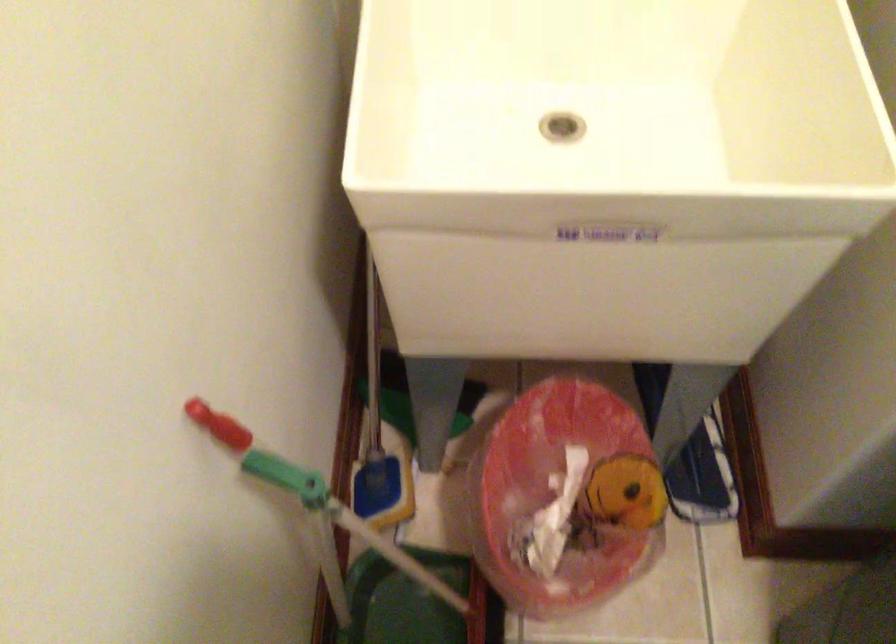
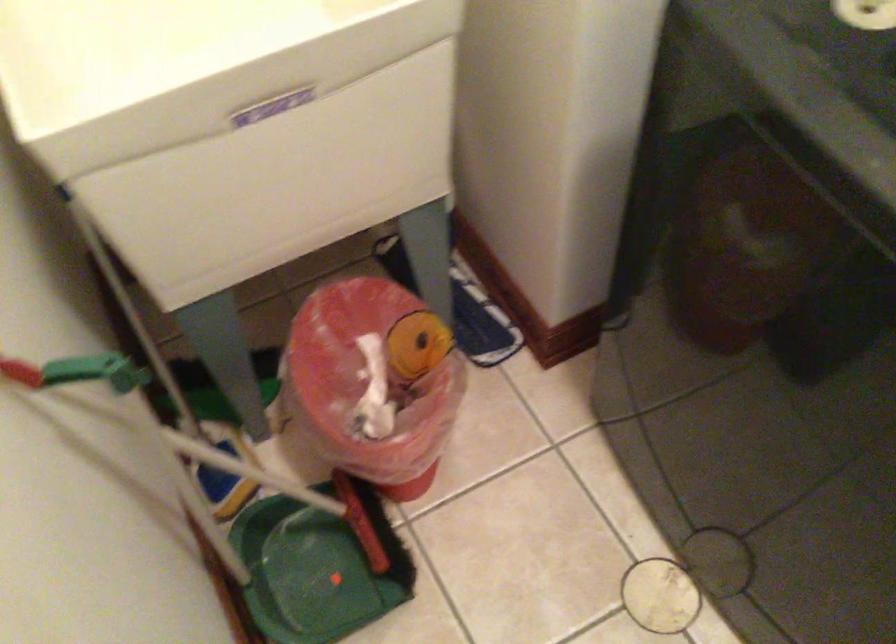
Find the pixel in the second image that matches the point at 564,494 in the first image.

(375, 377)